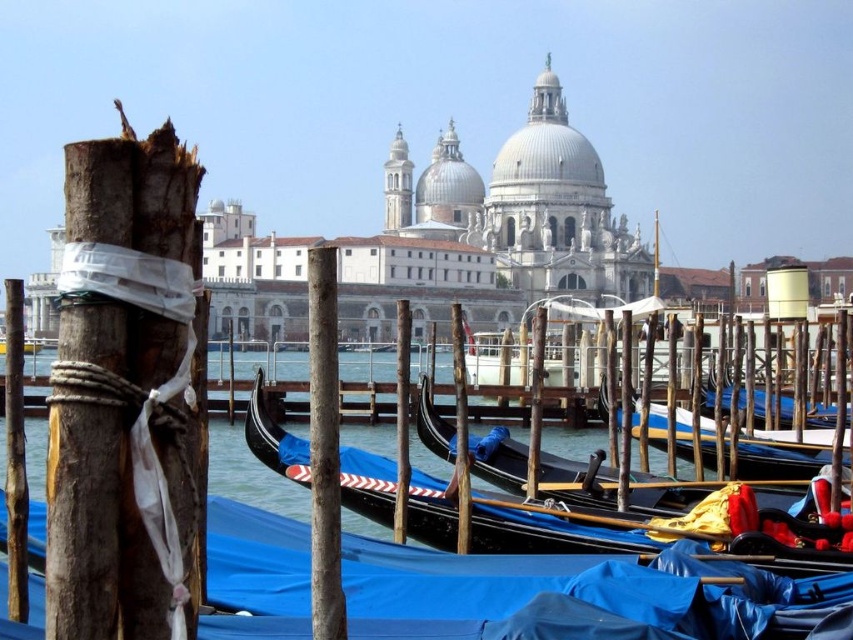
Question: Is black polished gondola at center above wooden gondola at center?

Choices:
 (A) yes
 (B) no

Answer: (B)

Question: Is black polished gondola at center wider than wooden gondola at center?

Choices:
 (A) yes
 (B) no

Answer: (A)

Question: Does black polished gondola at center have a greater width compared to wooden gondola at center?

Choices:
 (A) yes
 (B) no

Answer: (A)